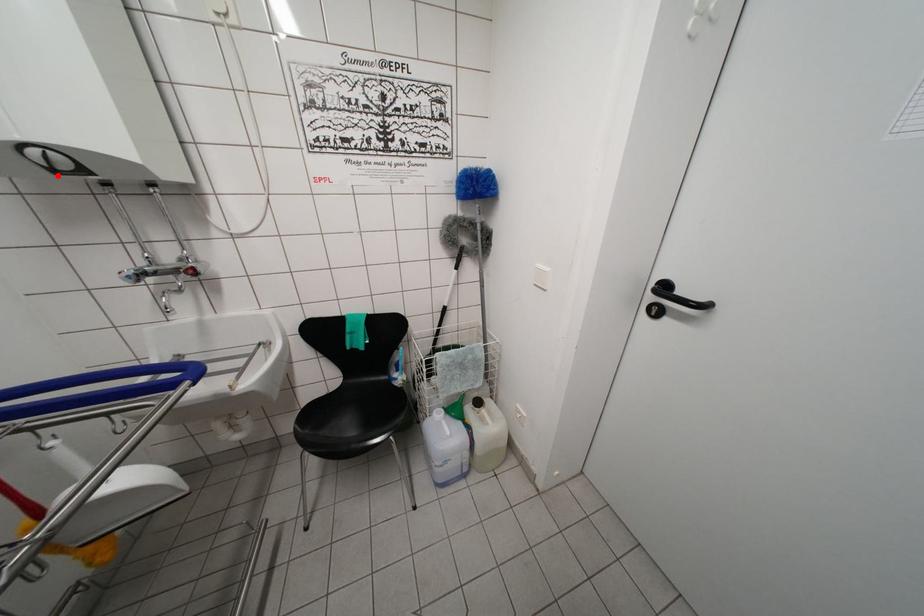
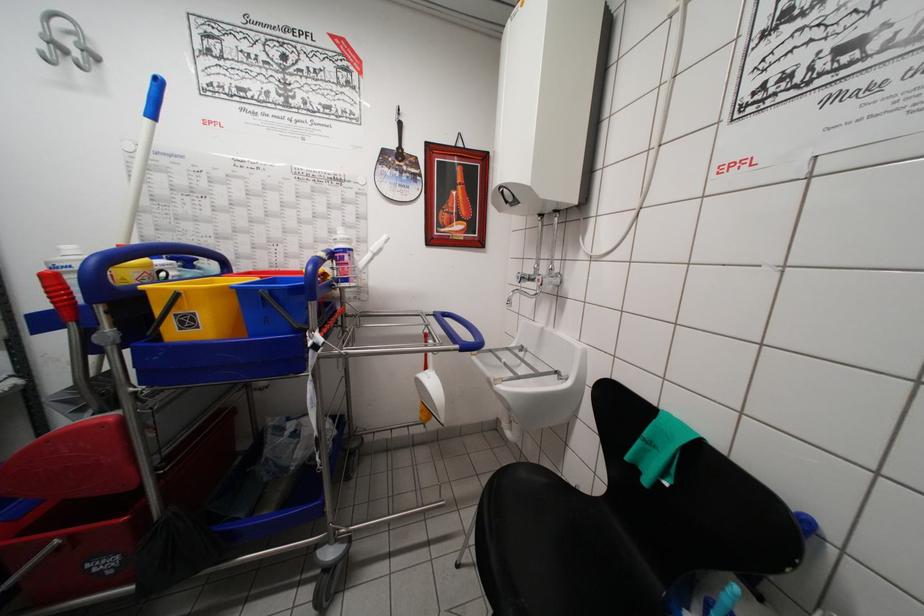
Find the pixel in the second image that matches the highlighted location in the first image.

(511, 207)